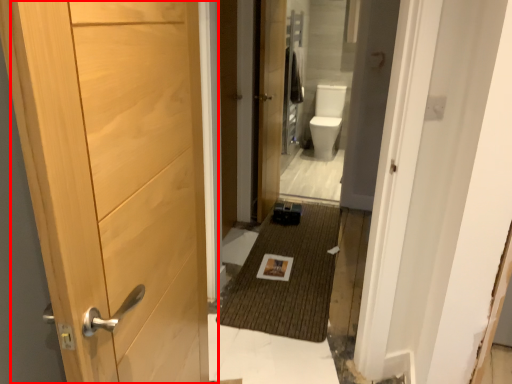
Question: From the image's perspective, where is door (annotated by the red box) located relative to door?

Choices:
 (A) below
 (B) above

Answer: (A)